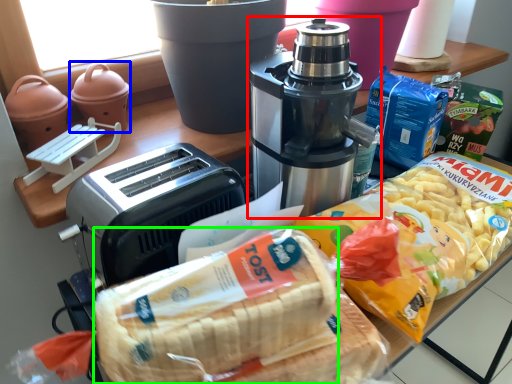
Question: Which object is positioned farthest from coffee maker (highlighted by a red box)? Select from appliance (highlighted by a blue box) and treat (highlighted by a green box).

Choices:
 (A) appliance
 (B) treat

Answer: (A)